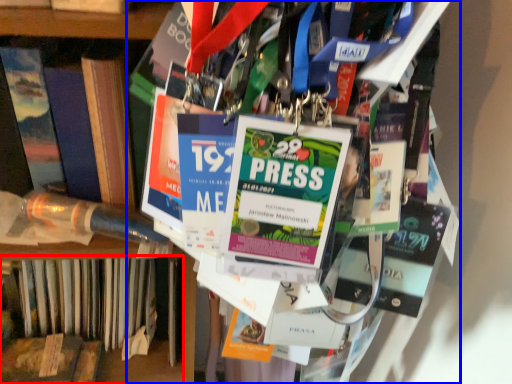
Question: Among these objects, which one is nearest to the camera, book (highlighted by a red box) or book (highlighted by a blue box)?

Choices:
 (A) book
 (B) book

Answer: (B)